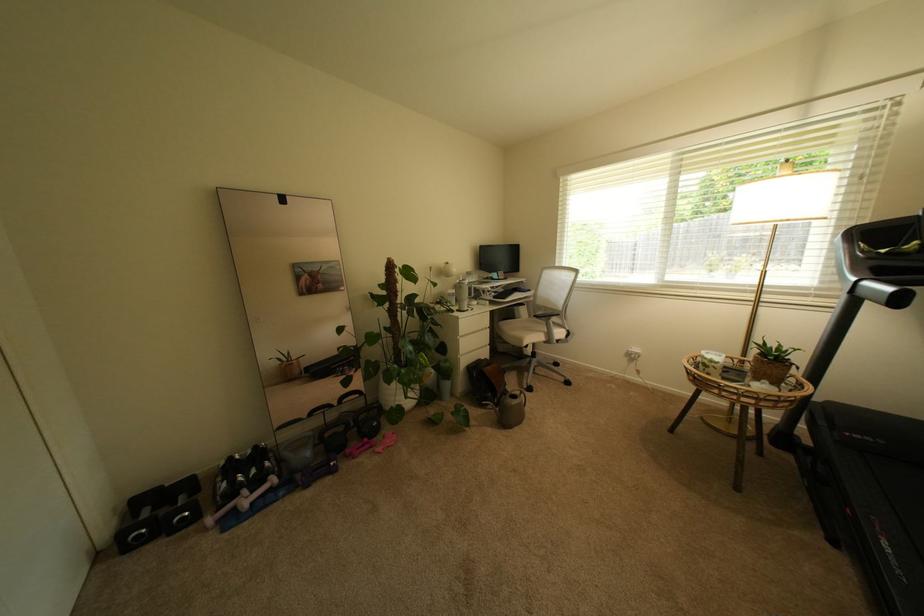
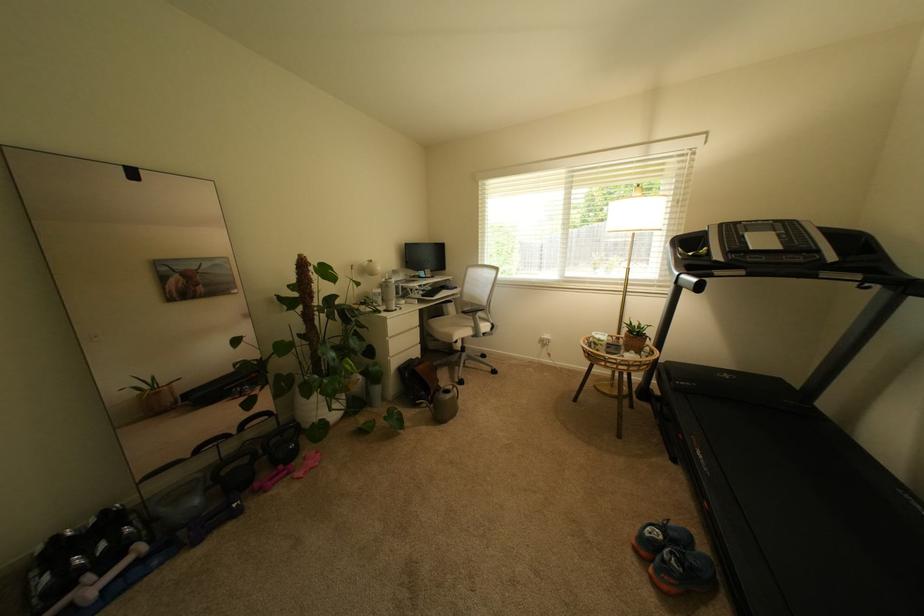
Where in the second image is the point corresponding to [529,342] from the first image?

(459, 338)